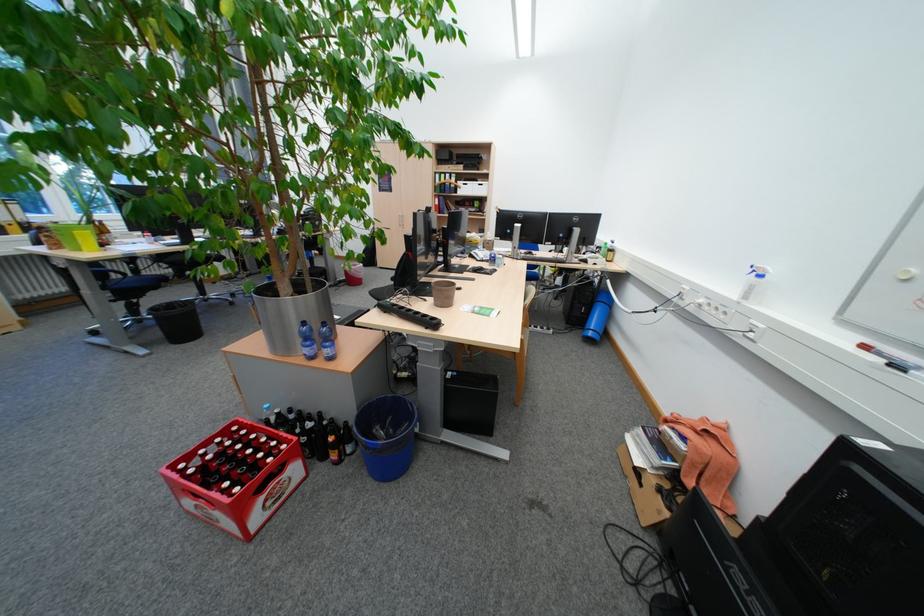
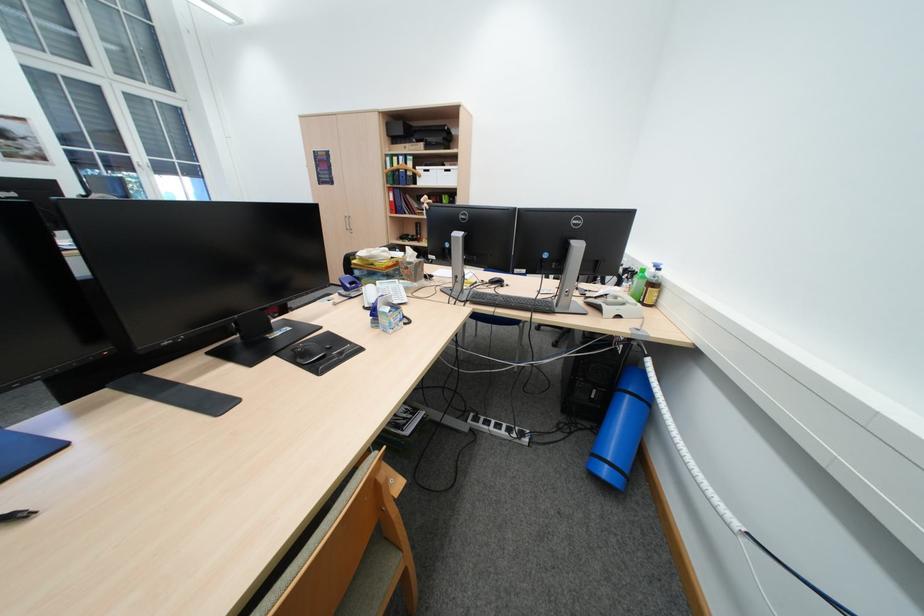
Find the pixel in the second image that matches (x=617, y=245) in the first image.

(655, 272)